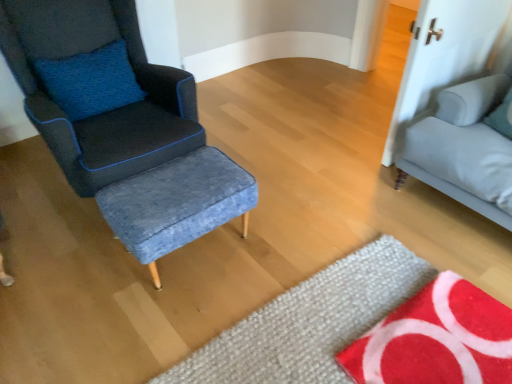
Locate an element on the screen. The image size is (512, 384). vacant area that lies to the right of matte blue fabric chair at left is located at coordinates [x=279, y=177].